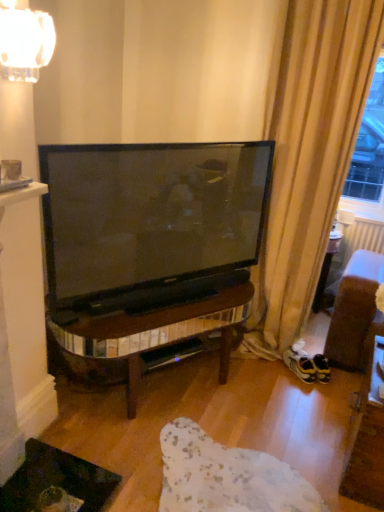
Question: Is point (49, 27) positioned closer to the camera than point (314, 368)?

Choices:
 (A) closer
 (B) farther

Answer: (A)

Question: In terms of width, does clear glass lampshade at upper left look wider or thinner when compared to yellow suede sneakers at lower right?

Choices:
 (A) thin
 (B) wide

Answer: (A)

Question: Estimate the real-world distances between objects in this image. Which object is farther from the beige fabric curtain at right?

Choices:
 (A) matte white mug at upper left
 (B) yellow suede sneakers at lower right
 (C) clear glass lampshade at upper left

Answer: (A)

Question: Considering the real-world distances, which object is farthest from the matte white mug at upper left?

Choices:
 (A) clear glass lampshade at upper left
 (B) yellow suede sneakers at lower right
 (C) beige fabric curtain at right

Answer: (B)